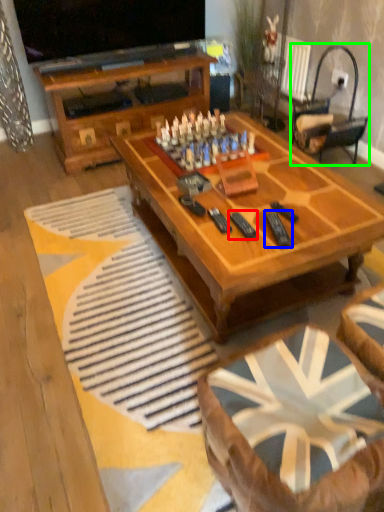
Question: Which object is the farthest from remote (highlighted by a red box)? Choose among these: remote (highlighted by a blue box) or rocking chair (highlighted by a green box).

Choices:
 (A) remote
 (B) rocking chair

Answer: (B)